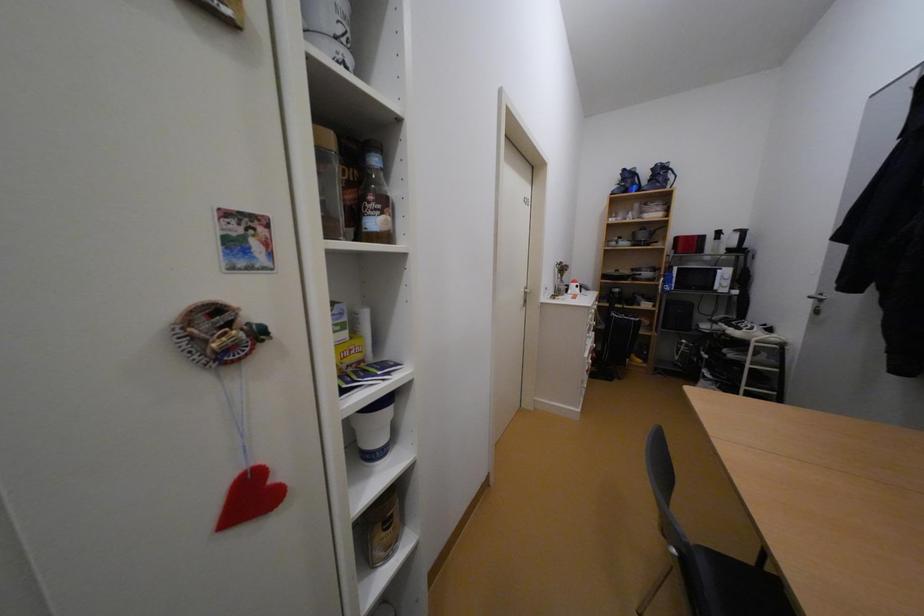
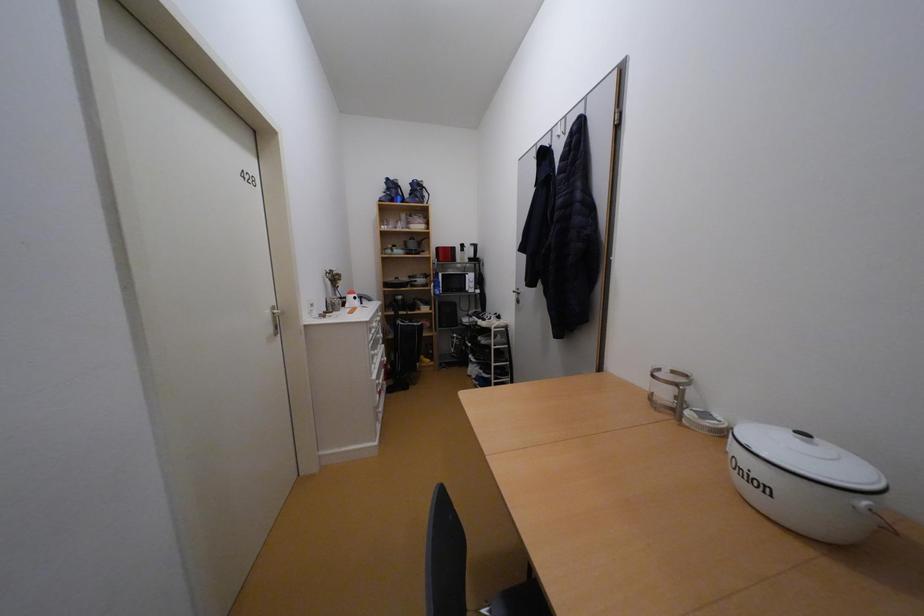
Question: How did the camera likely rotate?

Choices:
 (A) Left
 (B) Right
 (C) Up
 (D) Down

Answer: (B)